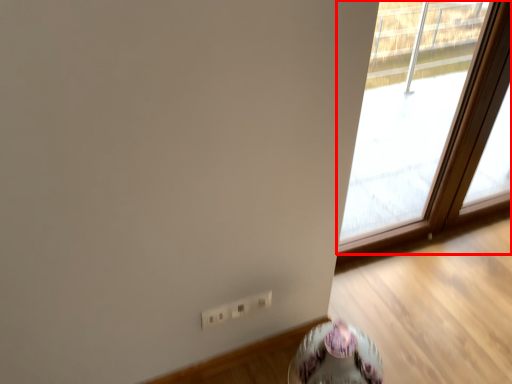
Question: Where is window (annotated by the red box) located in relation to round table in the image?

Choices:
 (A) left
 (B) right

Answer: (B)